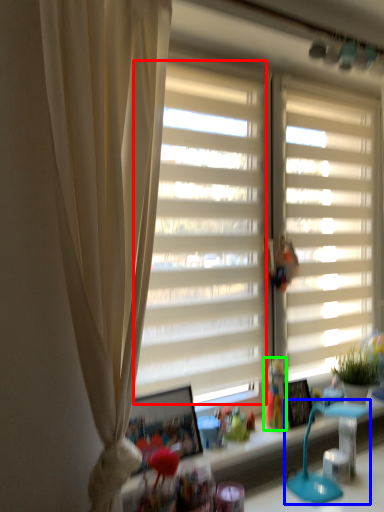
Question: Estimate the real-world distances between objects in this image. Which object is farther from window screen (highlighted by a red box), table lamp (highlighted by a blue box) or toy (highlighted by a green box)?

Choices:
 (A) table lamp
 (B) toy

Answer: (A)